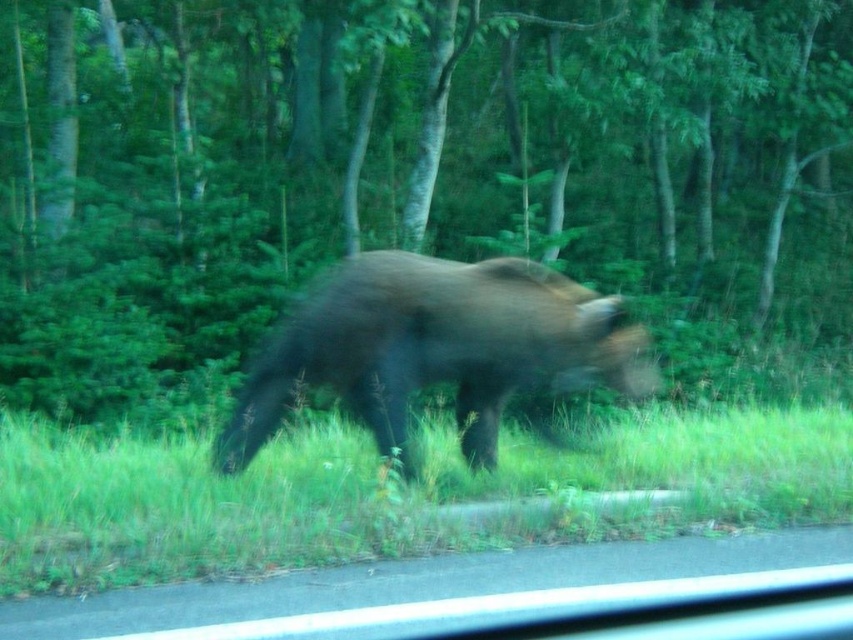
You are a hiker who wants to walk through the green grass at lower center without stepping on the brown furry bear at center. Can you do so safely?

The green grass at lower center has a lesser height compared to brown furry bear at center, so the grass is shorter than the bear. Since the bear is taller, it is likely standing above the grass, so you can walk through the grass without stepping on the bear as long as you avoid the area where the bear is located.

In the scene shown: You are a hiker in the forest and want to take a photo of the green leafy tree at center. Where should you position yourself to capture the tree in the center of your camera viewfinder?

Position yourself directly in front of the green leafy tree at center to ensure it appears centered in your camera viewfinder.